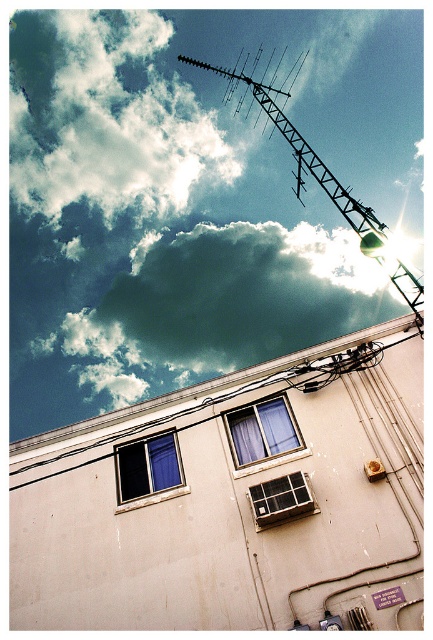
Question: Does metallic antenna at upper center have a lesser width compared to white plastic window at center?

Choices:
 (A) yes
 (B) no

Answer: (B)

Question: Which of the following is the closest to the observer?

Choices:
 (A) wooden frame window at center
 (B) metallic antenna at upper center
 (C) cloudy sky at upper center

Answer: (B)

Question: Which point is closer to the camera?

Choices:
 (A) wooden frame window at center
 (B) black wire at center

Answer: (A)

Question: Is the position of wooden frame window at center more distant than that of white plastic window at center?

Choices:
 (A) no
 (B) yes

Answer: (B)

Question: Does cloudy sky at upper center have a smaller size compared to blue glass window at center?

Choices:
 (A) no
 (B) yes

Answer: (A)

Question: Estimate the real-world distances between objects in this image. Which object is farther from the blue glass window at center?

Choices:
 (A) black wire at center
 (B) metallic antenna at upper center

Answer: (B)